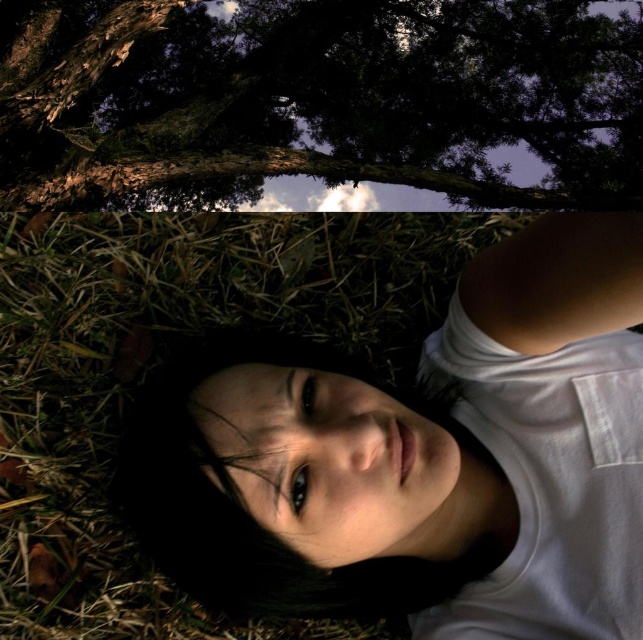
In the scene shown: You are a photographer taking a picture of the scene described. You want to ensure the white matte shirt at center is centered in the frame. Given its current position at point coordinates, what adjustment should you make to the camera to center it?

The white matte shirt at center is already positioned at the center coordinates of the frame, so no adjustment is needed.

You are a photographer wanting to capture a closeup of the white matte shirt at center and the brown textured bark at upper center in the same frame. Given that your camera has a maximum focus range of 8 feet, can you achieve this without moving either object?

The white matte shirt at center is 8.52 feet away from the brown textured bark at upper center. Since the distance exceeds the camera maximum focus range of 8 feet, you cannot capture both in the same frame without moving either object.